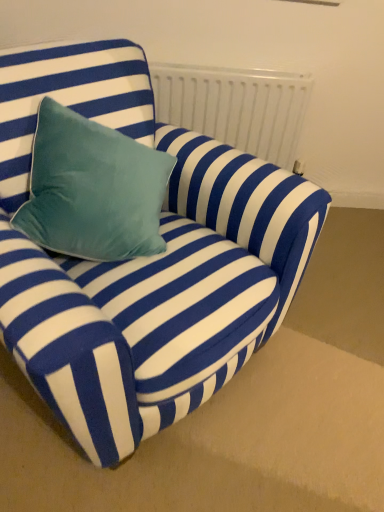
Question: Is white matte radiator at upper center positioned with its back to blue velvet couch at center?

Choices:
 (A) no
 (B) yes

Answer: (A)

Question: From the image's perspective, does white matte radiator at upper center appear lower than blue velvet couch at center?

Choices:
 (A) yes
 (B) no

Answer: (B)

Question: Considering the relative positions of white matte radiator at upper center and blue velvet couch at center in the image provided, is white matte radiator at upper center behind blue velvet couch at center?

Choices:
 (A) no
 (B) yes

Answer: (B)

Question: From a real-world perspective, is white matte radiator at upper center physically below blue velvet couch at center?

Choices:
 (A) no
 (B) yes

Answer: (B)

Question: Considering the relative sizes of white matte radiator at upper center and blue velvet couch at center in the image provided, is white matte radiator at upper center shorter than blue velvet couch at center?

Choices:
 (A) yes
 (B) no

Answer: (A)

Question: Is white matte radiator at upper center taller than blue velvet couch at center?

Choices:
 (A) no
 (B) yes

Answer: (A)

Question: From the image's perspective, is blue velvet couch at center below white matte radiator at upper center?

Choices:
 (A) yes
 (B) no

Answer: (A)

Question: Considering the relative positions of blue velvet couch at center and white matte radiator at upper center in the image provided, is blue velvet couch at center in front of white matte radiator at upper center?

Choices:
 (A) yes
 (B) no

Answer: (A)

Question: Can you confirm if blue velvet couch at center is smaller than white matte radiator at upper center?

Choices:
 (A) yes
 (B) no

Answer: (B)

Question: Is blue velvet couch at center taller than white matte radiator at upper center?

Choices:
 (A) no
 (B) yes

Answer: (B)

Question: From a real-world perspective, is blue velvet couch at center on top of white matte radiator at upper center?

Choices:
 (A) no
 (B) yes

Answer: (B)

Question: Is blue velvet couch at center turned away from white matte radiator at upper center?

Choices:
 (A) no
 (B) yes

Answer: (A)

Question: Is blue velvet couch at center inside or outside of white matte radiator at upper center?

Choices:
 (A) inside
 (B) outside

Answer: (B)